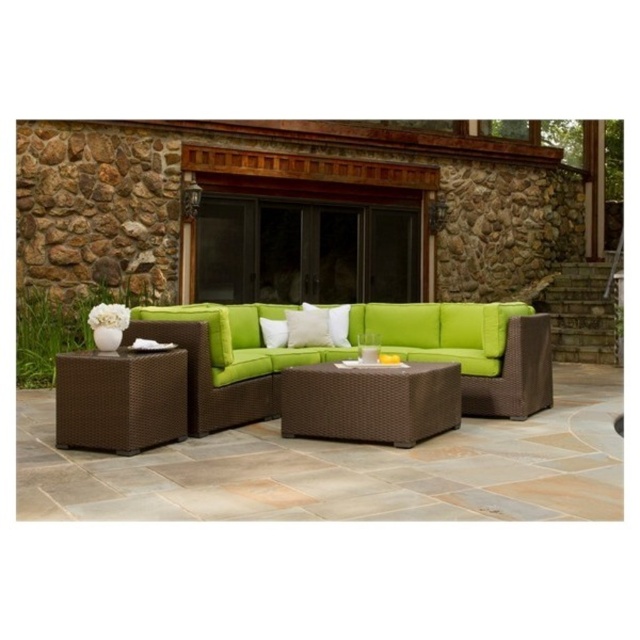
You are a delivery person carrying a package that requires a clear path of at least 8 feet to maneuver. You need to move from the brown wicker side table at lower left to the green woven couch at center. Based on the scene, can you safely navigate this path without obstacles?

The distance between the green woven couch at center and the brown wicker side table at lower left is 9.15 feet, which is greater than the required 8 feet. Therefore, you can safely navigate the path without obstacles.

You are sitting on the sofa and want to place your drink on a surface. Which object, the brown wicker coffee table at center or the white soft cushion at center, would be a more stable and suitable surface for placing your drink?

The brown wicker coffee table at center has a greater height compared to the white soft cushion at center, making it a more stable and suitable surface for placing your drink.

You are standing on the patio and want to move from the brown wicker side table at lower left to the green woven couch at center. Which direction should you move in?

To move from the brown wicker side table at lower left to the green woven couch at center, you should move to the right since the green woven couch at center is positioned to the right of the brown wicker side table at lower left.